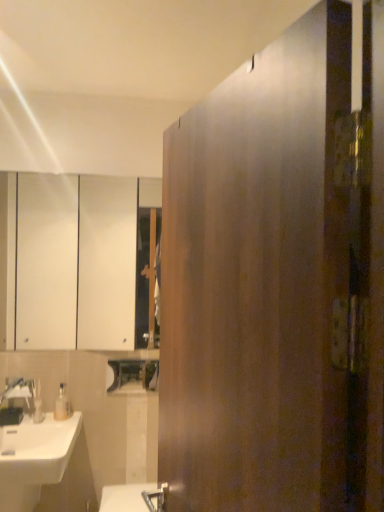
Question: Is satin wood door at center aimed at brushed metal faucet at lower left?

Choices:
 (A) yes
 (B) no

Answer: (B)

Question: Can you confirm if satin wood door at center is bigger than brushed metal faucet at lower left?

Choices:
 (A) yes
 (B) no

Answer: (A)

Question: Is brushed metal faucet at lower left inside satin wood door at center?

Choices:
 (A) yes
 (B) no

Answer: (B)

Question: Is satin wood door at center oriented away from brushed metal faucet at lower left?

Choices:
 (A) no
 (B) yes

Answer: (A)

Question: Considering the relative sizes of satin wood door at center and brushed metal faucet at lower left in the image provided, is satin wood door at center smaller than brushed metal faucet at lower left?

Choices:
 (A) no
 (B) yes

Answer: (A)

Question: Which is correct: translucent plastic soap dispenser at lower left is inside white glossy cabinet at upper left, or outside of it?

Choices:
 (A) outside
 (B) inside

Answer: (A)

Question: Considering their positions, is translucent plastic soap dispenser at lower left located in front of or behind white glossy cabinet at upper left?

Choices:
 (A) behind
 (B) front

Answer: (B)

Question: Does point (59, 416) appear closer or farther from the camera than point (122, 297)?

Choices:
 (A) farther
 (B) closer

Answer: (B)

Question: Considering the positions of translucent plastic soap dispenser at lower left and white glossy cabinet at upper left in the image, is translucent plastic soap dispenser at lower left taller or shorter than white glossy cabinet at upper left?

Choices:
 (A) tall
 (B) short

Answer: (B)

Question: Does point (36, 393) appear closer or farther from the camera than point (248, 446)?

Choices:
 (A) farther
 (B) closer

Answer: (A)

Question: Visually, is matte plastic soap dispenser at lower left positioned to the left or to the right of satin wood door at center?

Choices:
 (A) right
 (B) left

Answer: (B)

Question: Looking at the image, does matte plastic soap dispenser at lower left seem bigger or smaller compared to satin wood door at center?

Choices:
 (A) big
 (B) small

Answer: (B)

Question: Is matte plastic soap dispenser at lower left inside the boundaries of satin wood door at center, or outside?

Choices:
 (A) inside
 (B) outside

Answer: (B)

Question: From the image's perspective, relative to brushed metal faucet at lower left, is translucent plastic soap dispenser at lower left above or below?

Choices:
 (A) above
 (B) below

Answer: (B)

Question: Is point pos(59,390) closer or farther from the camera than point pos(21,403)?

Choices:
 (A) closer
 (B) farther

Answer: (B)